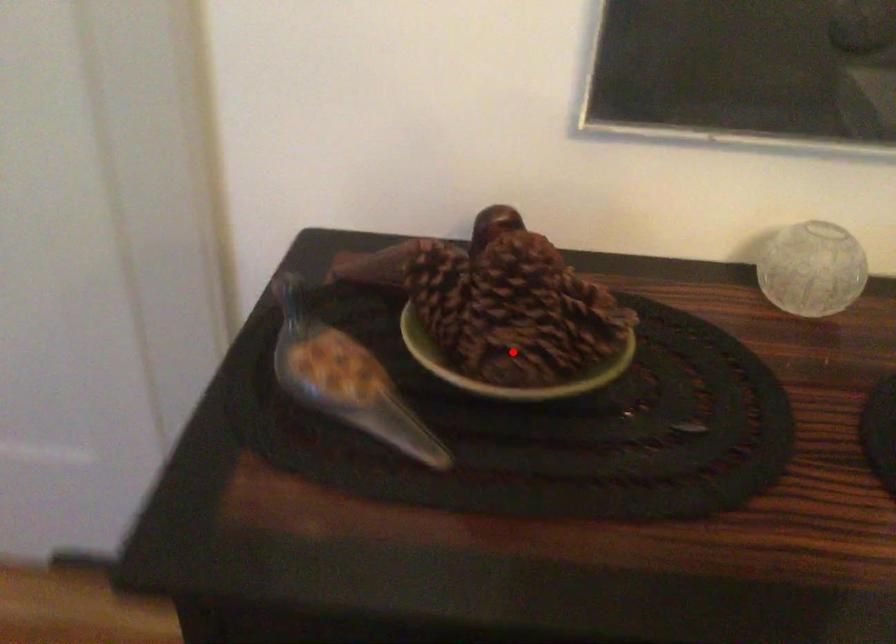
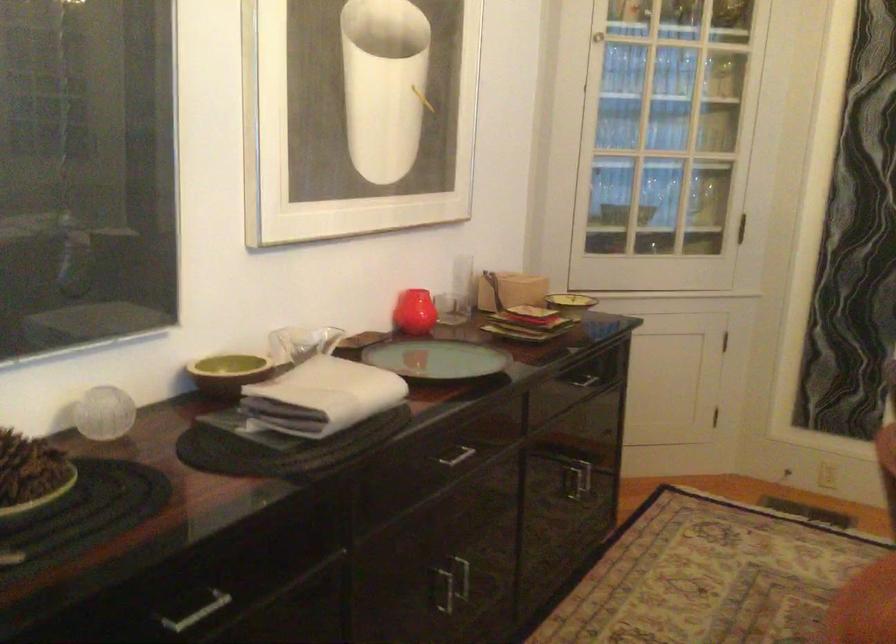
Question: I am providing you with two images of the same scene from different viewpoints. Given a red point in image1, look at the same physical point in image2. Is it:

Choices:
 (A) Closer to the viewpoint
 (B) Farther from the viewpoint

Answer: (B)